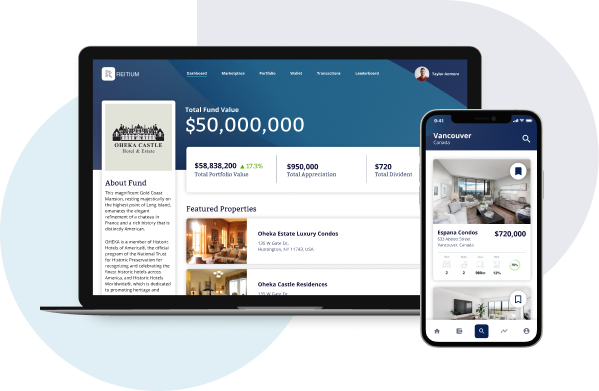
The width and height of the screenshot is (599, 391). Identify the location of grey laptop bottom. (328, 313).